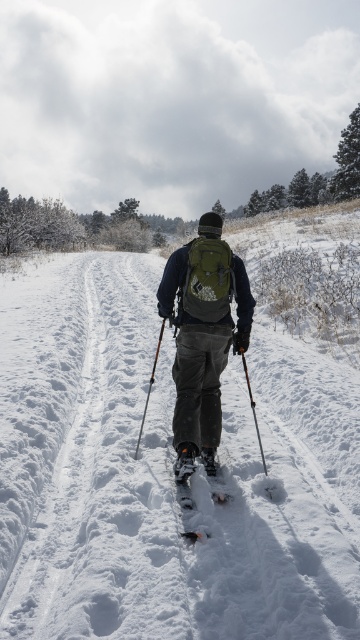
You are planning to carry both the green fabric backpack at center and the black matte ski at center on your back during a winter hike. Which item will have more space occupying vertically on your back?

The green fabric backpack at center has a greater height compared to the black matte ski at center, so it will occupy more vertical space on your back.

You are a drone operator trying to capture the best aerial shot of the cross country skier. The green fabric backpack at center is your main focus. Based on its position, where should you position the drone to ensure the backpack is centered in the frame?

The green fabric backpack at center is already positioned at point (204, 326), so the drone should be positioned directly above this coordinate to ensure the backpack remains centered in the frame.

In the scene shown: You are a hiker planning to cross a snowy area and have both a white textured snowshoe at center and a white rubber snowshoe at center. Based on their sizes, which one would you choose to distribute your weight more effectively on the snow?

The white textured snowshoe at center is bigger than the white rubber snowshoe at center, so it would distribute your weight more effectively on the snow.